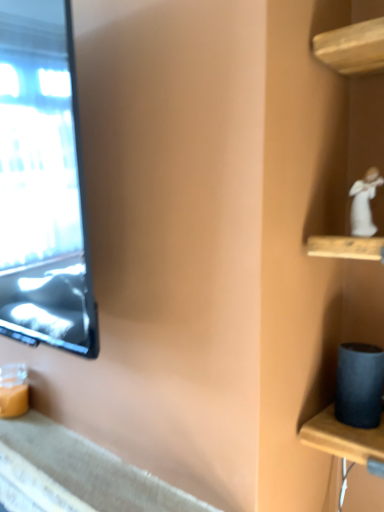
This screenshot has height=512, width=384. Describe the element at coordinates (75, 474) in the screenshot. I see `textured gray fabric at lower left` at that location.

In order to click on textured gray fabric at lower left in this screenshot , I will do `click(75, 474)`.

What do you see at coordinates (364, 203) in the screenshot?
I see `white porcelain figurine at upper right` at bounding box center [364, 203].

The height and width of the screenshot is (512, 384). In order to click on white porcelain figurine at upper right in this screenshot , I will do `click(364, 203)`.

You are a GUI agent. You are given a task and a screenshot of the screen. Output one action in this format:
    pyautogui.click(x=<x>, y=<y>)
    Task: Click on the textured gray fabric at lower left
    This screenshot has width=384, height=512.
    Given the screenshot: What is the action you would take?
    pyautogui.click(x=75, y=474)

Between textured gray fabric at lower left and white porcelain figurine at upper right, which one appears on the right side from the viewer's perspective?

white porcelain figurine at upper right is more to the right.

Does textured gray fabric at lower left lie behind white porcelain figurine at upper right?

That is False.

Considering the positions of points (28, 492) and (353, 228), is point (28, 492) closer to camera compared to point (353, 228)?

No.

From the image's perspective, between textured gray fabric at lower left and white porcelain figurine at upper right, who is located below?

textured gray fabric at lower left appears lower in the image.

From a real-world perspective, is textured gray fabric at lower left positioned under white porcelain figurine at upper right based on gravity?

Yes, from a real-world perspective, textured gray fabric at lower left is beneath white porcelain figurine at upper right.

Which of these two, textured gray fabric at lower left or white porcelain figurine at upper right, is thinner?

Thinner between the two is white porcelain figurine at upper right.

Between textured gray fabric at lower left and white porcelain figurine at upper right, which one has more height?

Standing taller between the two is white porcelain figurine at upper right.

Considering the sizes of textured gray fabric at lower left and white porcelain figurine at upper right in the image, is textured gray fabric at lower left bigger or smaller than white porcelain figurine at upper right?

textured gray fabric at lower left is bigger than white porcelain figurine at upper right.

Is textured gray fabric at lower left completely or partially outside of white porcelain figurine at upper right?

Yes, textured gray fabric at lower left is located beyond the bounds of white porcelain figurine at upper right.

Would you consider textured gray fabric at lower left to be distant from white porcelain figurine at upper right?

No, textured gray fabric at lower left is not far from white porcelain figurine at upper right.

Is textured gray fabric at lower left oriented towards white porcelain figurine at upper right?

No.

Based on the photo, can you tell me how much textured gray fabric at lower left and white porcelain figurine at upper right differ in facing direction?

The facing directions of textured gray fabric at lower left and white porcelain figurine at upper right are 0.909 degrees apart.

Identify the location of miniature above the textured gray fabric at lower left (from a real-world perspective). This screenshot has height=512, width=384. (364, 203).

Does white porcelain figurine at upper right appear on the right side of textured gray fabric at lower left?

Correct, you'll find white porcelain figurine at upper right to the right of textured gray fabric at lower left.

Which object is more forward, white porcelain figurine at upper right or textured gray fabric at lower left?

textured gray fabric at lower left is closer to the camera.

Which point is more distant from viewer, (353, 209) or (123, 462)?

The point (123, 462) is farther from the camera.

From the image's perspective, is white porcelain figurine at upper right above or below textured gray fabric at lower left?

Based on their image positions, white porcelain figurine at upper right is located above textured gray fabric at lower left.

From a real-world perspective, relative to textured gray fabric at lower left, is white porcelain figurine at upper right vertically above or below?

In terms of real-world spatial position, white porcelain figurine at upper right is above textured gray fabric at lower left.

From the picture: Considering the sizes of white porcelain figurine at upper right and textured gray fabric at lower left in the image, is white porcelain figurine at upper right wider or thinner than textured gray fabric at lower left?

Clearly, white porcelain figurine at upper right has less width compared to textured gray fabric at lower left.

Is white porcelain figurine at upper right taller than textured gray fabric at lower left?

Yes.

Does white porcelain figurine at upper right have a smaller size compared to textured gray fabric at lower left?

Yes, white porcelain figurine at upper right is smaller than textured gray fabric at lower left.

Is textured gray fabric at lower left surrounded by white porcelain figurine at upper right?

No, textured gray fabric at lower left is not surrounded by white porcelain figurine at upper right.

Is white porcelain figurine at upper right in contact with textured gray fabric at lower left?

No, white porcelain figurine at upper right is not next to textured gray fabric at lower left.

Does white porcelain figurine at upper right turn towards textured gray fabric at lower left?

No, white porcelain figurine at upper right is not turned towards textured gray fabric at lower left.

How many degrees apart are the facing directions of white porcelain figurine at upper right and textured gray fabric at lower left?

The facing directions of white porcelain figurine at upper right and textured gray fabric at lower left are 0.909 degrees apart.

Locate an element on the screen. Image resolution: width=384 pixels, height=512 pixels. counter top in front of the white porcelain figurine at upper right is located at coordinates (75, 474).

Image resolution: width=384 pixels, height=512 pixels. I want to click on counter top lying below the white porcelain figurine at upper right (from the image's perspective), so click(75, 474).

I want to click on counter top in front of the white porcelain figurine at upper right, so click(75, 474).